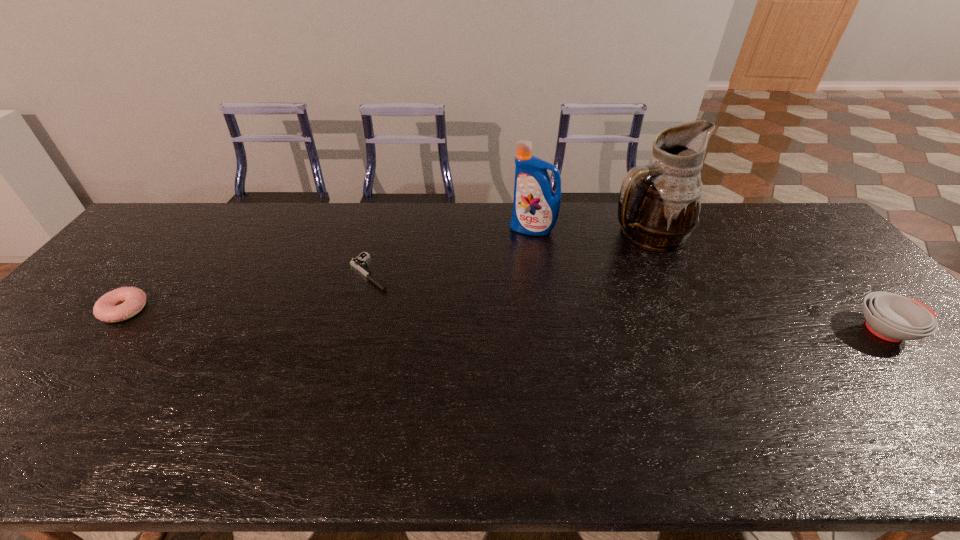
Image resolution: width=960 pixels, height=540 pixels. What are the coordinates of `empty location between the fourth object from right to left and the second shortest object` in the screenshot? It's located at (247, 291).

At what (x,y) coordinates should I click in order to perform the action: click on object that can be found as the second closest to the soup bowl. Please return your answer as a coordinate pair (x, y). The width and height of the screenshot is (960, 540). Looking at the image, I should click on (536, 206).

Identify the location of object that stands as the closest to the leftmost object. The width and height of the screenshot is (960, 540). (358, 263).

At what (x,y) coordinates should I click in order to perform the action: click on free location that satisfies the following two spatial constraints: 1. on the back side of the second object from right to left; 2. on the left side of the pistol. Please return your answer as a coordinate pair (x, y). The image size is (960, 540). Looking at the image, I should click on (380, 233).

Image resolution: width=960 pixels, height=540 pixels. Find the location of `free space that satisfies the following two spatial constraints: 1. on the front side of the third tallest object; 2. on the left side of the tallest object`. free space that satisfies the following two spatial constraints: 1. on the front side of the third tallest object; 2. on the left side of the tallest object is located at coordinates pyautogui.click(x=691, y=330).